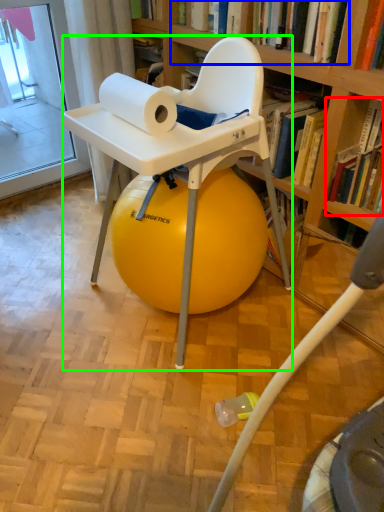
Question: Which object is the closest to the book (highlighted by a red box)? Choose among these: book (highlighted by a blue box) or chair (highlighted by a green box).

Choices:
 (A) book
 (B) chair

Answer: (A)